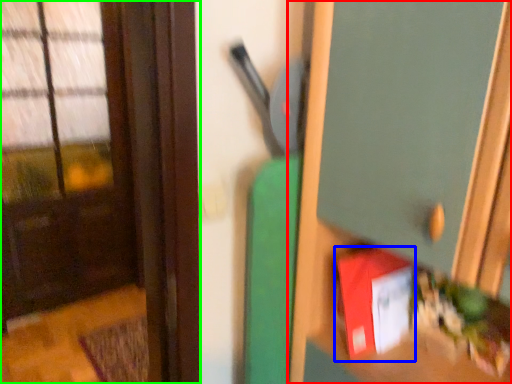
Question: Estimate the real-world distances between objects in this image. Which object is closer to dresser (highlighted by a red box), book (highlighted by a blue box) or door (highlighted by a green box)?

Choices:
 (A) book
 (B) door

Answer: (A)